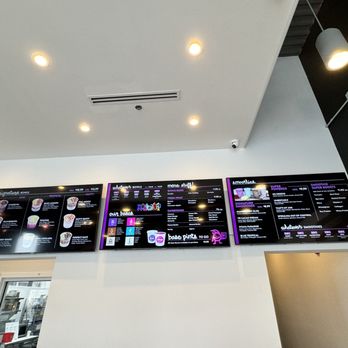
You are a GUI agent. You are given a task and a screenshot of the screen. Output one action in this format:
    pyautogui.click(x=<x>, y=<y>)
    Task: Click on the air vent
    The width and height of the screenshot is (348, 348).
    Given the screenshot: What is the action you would take?
    pyautogui.click(x=116, y=101)